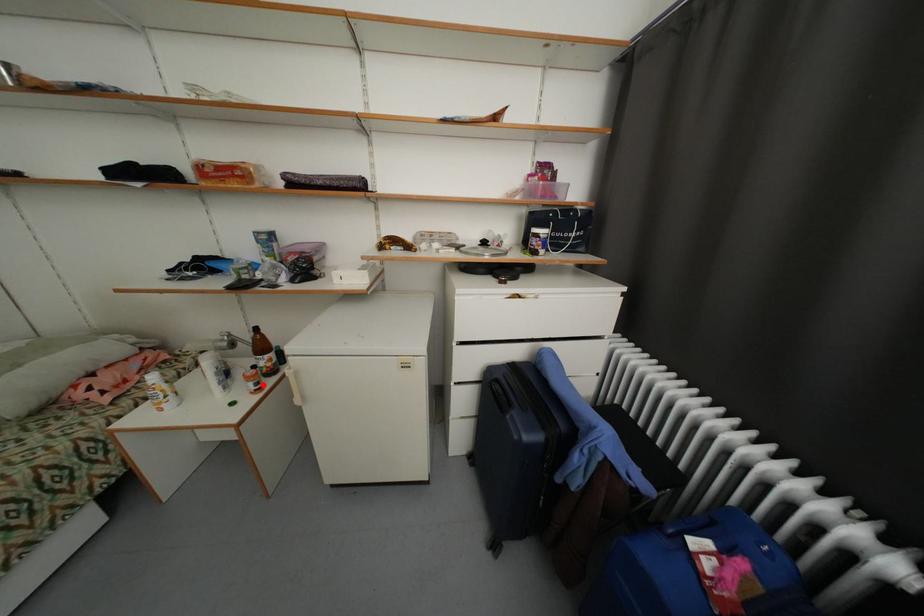
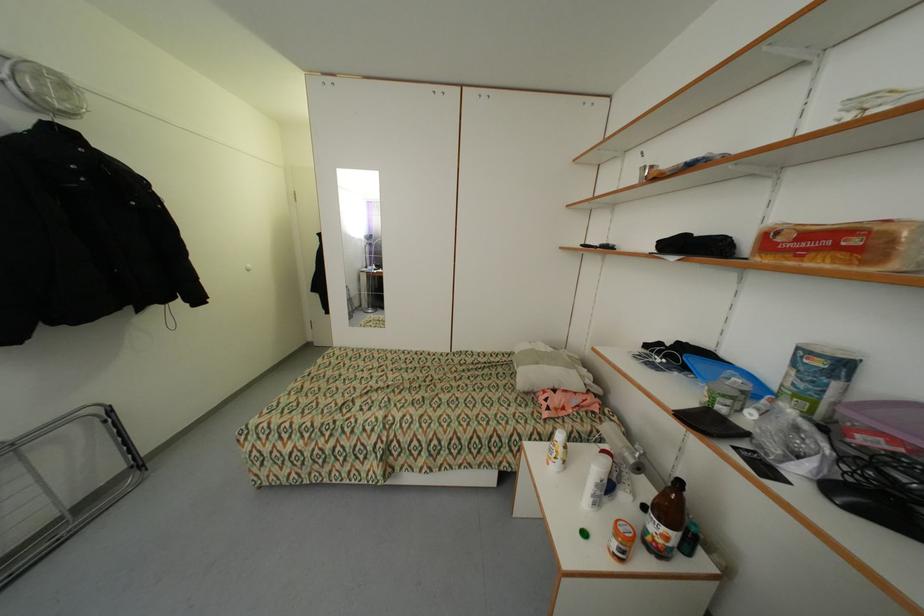
Question: I am providing you with two images of the same scene from different viewpoints. A red point is shown in image1. For the corresponding object point in image2, is it positioned nearer or farther from the camera?

Choices:
 (A) Nearer
 (B) Farther

Answer: (A)